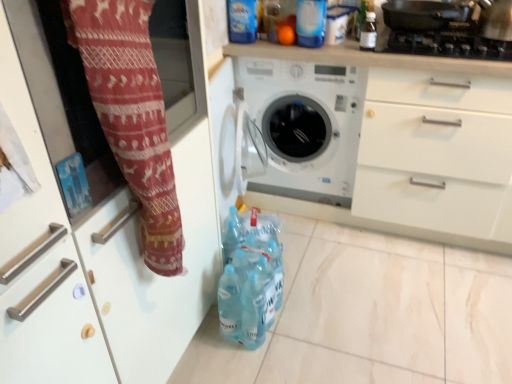
Image resolution: width=512 pixels, height=384 pixels. Describe the element at coordinates (368, 32) in the screenshot. I see `transparent plastic bottle at upper right, the 2th bottle ordered from the bottom` at that location.

Locate an element on the screen. This screenshot has height=384, width=512. black matte gas stove at upper right is located at coordinates (449, 43).

Identify the location of red knit fabric at left. (99, 230).

Does point (126, 255) come closer to viewer compared to point (369, 42)?

Yes, point (126, 255) is in front of point (369, 42).

Measure the distance between red knit fabric at left and transparent plastic bottle at upper right, arranged as the 2th bottle when viewed from the left.

red knit fabric at left is 1.13 meters away from transparent plastic bottle at upper right, arranged as the 2th bottle when viewed from the left.

From a real-world perspective, who is located lower, red knit fabric at left or transparent plastic bottle at upper right, placed as the first bottle when sorted from right to left?

From a 3D spatial view, red knit fabric at left is below.

From a real-world perspective, is transparent plastic bottle at upper right, arranged as the 2th bottle when viewed from the left, physically below red knit fabric at left?

No.

Which is in front, point (368, 11) or point (14, 369)?

The point (14, 369) is closer to the camera.

Considering the relative positions of transparent plastic bottle at upper right, the 2th bottle ordered from the bottom, and red knit fabric at left in the image provided, is transparent plastic bottle at upper right, the 2th bottle ordered from the bottom, in front of red knit fabric at left?

No.

In terms of height, does transparent plastic bottle at upper right, the 2th bottle ordered from the bottom, look taller or shorter compared to red knit fabric at left?

In the image, transparent plastic bottle at upper right, the 2th bottle ordered from the bottom, appears to be shorter than red knit fabric at left.

From a real-world perspective, which object stands above the other?

black matte gas stove at upper right.

Can you confirm if black matte gas stove at upper right is wider than translucent plastic bottles at lower center, the first bottle viewed from the left?

Yes, black matte gas stove at upper right is wider than translucent plastic bottles at lower center, the first bottle viewed from the left.

Consider the image. Considering their positions, is black matte gas stove at upper right located in front of or behind translucent plastic bottles at lower center, arranged as the 2th bottle when viewed from the right?

In the image, black matte gas stove at upper right appears behind translucent plastic bottles at lower center, arranged as the 2th bottle when viewed from the right.

From the image's perspective, is black matte gas stove at upper right located beneath translucent plastic bottles at lower center, arranged as the 2th bottle when viewed from the right?

Incorrect, from the image's perspective, black matte gas stove at upper right is higher than translucent plastic bottles at lower center, arranged as the 2th bottle when viewed from the right.

Which object is positioned more to the left, black matte gas stove at upper right or white plastic washing machine at center?

white plastic washing machine at center.

Is white plastic washing machine at center inside black matte gas stove at upper right?

No, white plastic washing machine at center is located outside of black matte gas stove at upper right.

Can you confirm if black matte gas stove at upper right is taller than white plastic washing machine at center?

Incorrect, the height of black matte gas stove at upper right is not larger of that of white plastic washing machine at center.

Is transparent plastic bottle at upper right, placed as the first bottle when sorted from right to left, smaller than translucent plastic bottles at lower center, the second bottle from the top?

Indeed, transparent plastic bottle at upper right, placed as the first bottle when sorted from right to left, has a smaller size compared to translucent plastic bottles at lower center, the second bottle from the top.

From a real-world perspective, is transparent plastic bottle at upper right, the 2th bottle ordered from the bottom, physically located above or below translucent plastic bottles at lower center, arranged as the 2th bottle when viewed from the right?

transparent plastic bottle at upper right, the 2th bottle ordered from the bottom, is situated higher than translucent plastic bottles at lower center, arranged as the 2th bottle when viewed from the right, in the real world.

Does point (373, 38) come behind point (223, 335)?

Yes.

Is transparent plastic bottle at upper right, placed as the first bottle when sorted from right to left, placed right next to translucent plastic bottles at lower center, the first bottle viewed from the left?

No, transparent plastic bottle at upper right, placed as the first bottle when sorted from right to left, is not in contact with translucent plastic bottles at lower center, the first bottle viewed from the left.

Considering the sizes of objects translucent plastic bottles at lower center, the second bottle from the top, and red knit fabric at left in the image provided, who is wider, translucent plastic bottles at lower center, the second bottle from the top, or red knit fabric at left?

translucent plastic bottles at lower center, the second bottle from the top, is wider.

Between point (242, 251) and point (93, 362), which one is positioned in front?

The point (93, 362) is closer.

Is translucent plastic bottles at lower center, placed as the first bottle when sorted from bottom to top, bigger than red knit fabric at left?

Actually, translucent plastic bottles at lower center, placed as the first bottle when sorted from bottom to top, might be smaller than red knit fabric at left.

At what (x,y) coordinates should I click in order to perform the action: click on cabinetry on the left of translucent plastic bottles at lower center, the first bottle viewed from the left. Please return your answer as a coordinate pair (x, y). This screenshot has height=384, width=512. Looking at the image, I should click on coord(99,230).

Based on their sizes in the image, would you say red knit fabric at left is bigger or smaller than black matte gas stove at upper right?

In the image, red knit fabric at left appears to be larger than black matte gas stove at upper right.

Is red knit fabric at left positioned far away from black matte gas stove at upper right?

Indeed, red knit fabric at left is not near black matte gas stove at upper right.

Looking at this image, how many degrees apart are the facing directions of red knit fabric at left and black matte gas stove at upper right?

The facing directions of red knit fabric at left and black matte gas stove at upper right are 90.1 degrees apart.

What are the coordinates of `cabinetry lying in front of the transparent plastic bottle at upper right, arranged as the 2th bottle when viewed from the left` in the screenshot? It's located at (99, 230).

Find the location of a particular element. cabinetry that appears below the transparent plastic bottle at upper right, placed as the first bottle when sorted from right to left (from the image's perspective) is located at coordinates (99, 230).

Estimate the real-world distances between objects in this image. Which object is closer to translucent plastic bottles at lower center, the second bottle from the top, white plastic washing machine at center or red knit fabric at left?

The object closer to translucent plastic bottles at lower center, the second bottle from the top, is red knit fabric at left.

Which object lies nearer to the anchor point black matte gas stove at upper right, white plastic washing machine at center or red knit fabric at left?

white plastic washing machine at center is positioned closer to the anchor black matte gas stove at upper right.

When comparing their distances from white plastic washing machine at center, does translucent plastic bottles at lower center, placed as the first bottle when sorted from bottom to top, or black matte gas stove at upper right seem closer?

black matte gas stove at upper right is closer to white plastic washing machine at center.

From the image, which object appears to be farther from translucent plastic bottles at lower center, the second bottle from the top, white plastic washing machine at center or transparent plastic bottle at upper right, placed as the first bottle when sorted from right to left?

transparent plastic bottle at upper right, placed as the first bottle when sorted from right to left, is positioned further to the anchor translucent plastic bottles at lower center, the second bottle from the top.

Which object lies nearer to the anchor point red knit fabric at left, transparent plastic bottle at upper right, placed as the first bottle when sorted from right to left, or translucent plastic bottles at lower center, the second bottle from the top?

Among the two, translucent plastic bottles at lower center, the second bottle from the top, is located nearer to red knit fabric at left.

From the image, which object appears to be nearer to transparent plastic bottle at upper right, the 2th bottle ordered from the bottom, translucent plastic bottles at lower center, arranged as the 2th bottle when viewed from the right, or red knit fabric at left?

Based on the image, translucent plastic bottles at lower center, arranged as the 2th bottle when viewed from the right, appears to be nearer to transparent plastic bottle at upper right, the 2th bottle ordered from the bottom.

From the image, which object appears to be nearer to white plastic washing machine at center, translucent plastic bottles at lower center, arranged as the 2th bottle when viewed from the right, or red knit fabric at left?

translucent plastic bottles at lower center, arranged as the 2th bottle when viewed from the right, lies closer to white plastic washing machine at center than the other object.

Considering their positions, is black matte gas stove at upper right positioned closer to white plastic washing machine at center than red knit fabric at left?

black matte gas stove at upper right is positioned closer to the anchor white plastic washing machine at center.

Where is `bottle between black matte gas stove at upper right and translucent plastic bottles at lower center, arranged as the 2th bottle when viewed from the right, in the up-down direction`? This screenshot has width=512, height=384. bottle between black matte gas stove at upper right and translucent plastic bottles at lower center, arranged as the 2th bottle when viewed from the right, in the up-down direction is located at coordinates (368, 32).

This screenshot has width=512, height=384. I want to click on gas stove between red knit fabric at left and white plastic washing machine at center in the front-back direction, so click(449, 43).

Where is `gas stove between red knit fabric at left and transparent plastic bottle at upper right, arranged as the 2th bottle when viewed from the left, in the front-back direction`? Image resolution: width=512 pixels, height=384 pixels. gas stove between red knit fabric at left and transparent plastic bottle at upper right, arranged as the 2th bottle when viewed from the left, in the front-back direction is located at coordinates (449, 43).

Where is `bottle located between red knit fabric at left and transparent plastic bottle at upper right, the 2th bottle ordered from the bottom, in the depth direction`? This screenshot has width=512, height=384. bottle located between red knit fabric at left and transparent plastic bottle at upper right, the 2th bottle ordered from the bottom, in the depth direction is located at coordinates (250, 278).